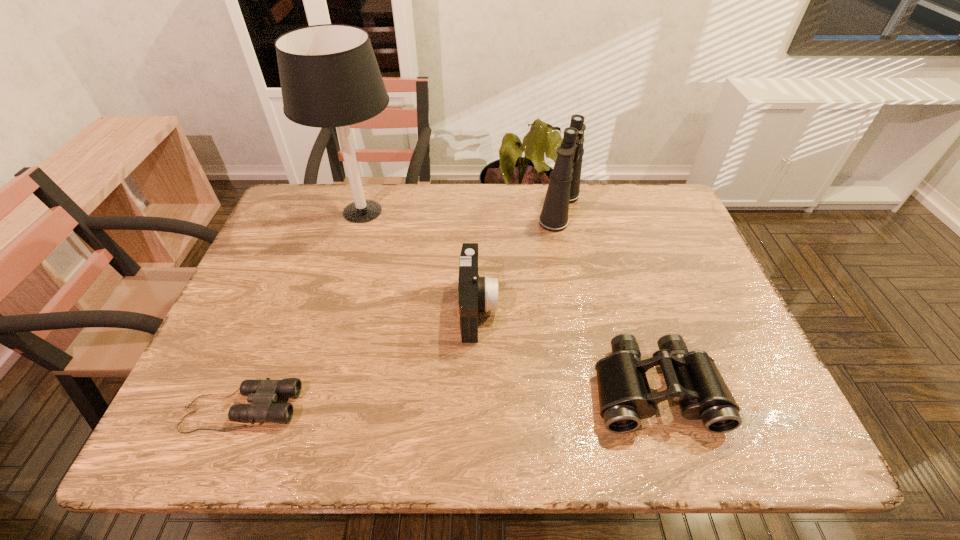
Image resolution: width=960 pixels, height=540 pixels. In order to click on vacant region between the second tallest object and the second shortest binoculars in this screenshot , I will do pyautogui.click(x=607, y=299).

Find the location of a particular element. The width and height of the screenshot is (960, 540). free space between the leftmost binoculars and the second shortest object is located at coordinates (447, 399).

Where is `empty space that is in between the fourth tallest object and the tallest binoculars`? The image size is (960, 540). empty space that is in between the fourth tallest object and the tallest binoculars is located at coordinates (x=607, y=299).

Where is `free space that is in between the farthest binoculars and the third tallest object`? The width and height of the screenshot is (960, 540). free space that is in between the farthest binoculars and the third tallest object is located at coordinates (518, 259).

Locate an element on the screen. The height and width of the screenshot is (540, 960). free space that is in between the third object from right to left and the fourth shortest object is located at coordinates (518, 259).

The width and height of the screenshot is (960, 540). What are the coordinates of `vacant space that is in between the tallest binoculars and the second tallest binoculars` in the screenshot? It's located at (607, 299).

Choose which object is the third nearest neighbor to the shortest binoculars. Please provide its 2D coordinates. Your answer should be formatted as a tuple, i.e. [(x, y)], where the tuple contains the x and y coordinates of a point satisfying the conditions above.

[(692, 378)]

Image resolution: width=960 pixels, height=540 pixels. I want to click on object that is the second closest one to the shortest object, so click(329, 75).

Identify which binoculars is the third nearest to the third object from left to right. Please provide its 2D coordinates. Your answer should be formatted as a tuple, i.e. [(x, y)], where the tuple contains the x and y coordinates of a point satisfying the conditions above.

[(262, 394)]

Select which binoculars appears as the closest to the camcorder. Please provide its 2D coordinates. Your answer should be formatted as a tuple, i.e. [(x, y)], where the tuple contains the x and y coordinates of a point satisfying the conditions above.

[(692, 378)]